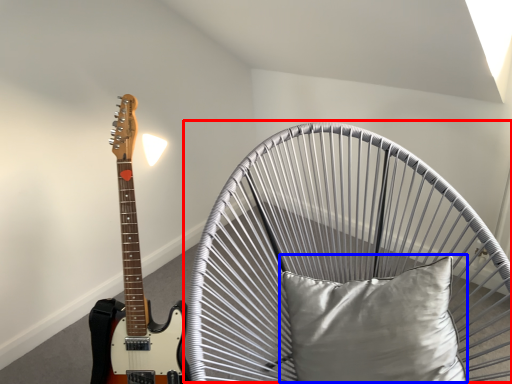
Question: Among these objects, which one is farthest to the camera, swivel chair (highlighted by a red box) or pillow (highlighted by a blue box)?

Choices:
 (A) swivel chair
 (B) pillow

Answer: (B)